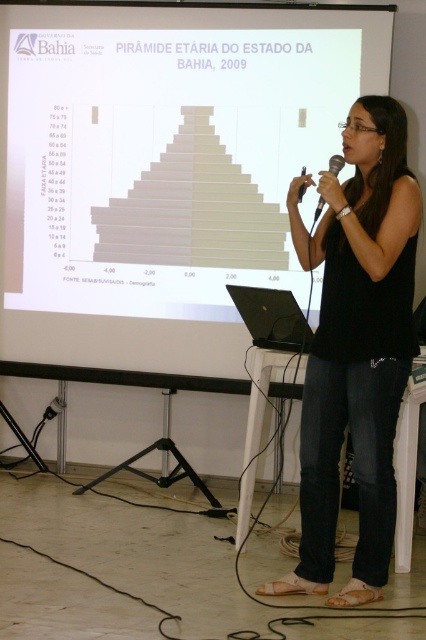
You are an event organizer setting up the stage for a presentation. You need to ensure that the white paper at upper center and the black plastic microphone at center are visible to the audience. Based on their sizes, which object should be placed closer to the front of the stage to maintain visibility?

The black plastic microphone at center should be placed closer to the front of the stage since it is narrower than the white paper at upper center, which is wider. This arrangement ensures both objects remain visible to the audience.

You are an event organizer who needs to adjust the microphone placement during a presentation. The woman is wearing a black cotton shirt at center and holding a black plastic microphone at center. Which object is closer to the audience?

The black cotton shirt at center is in front of the black plastic microphone at center, so the black cotton shirt at center is closer to the audience.